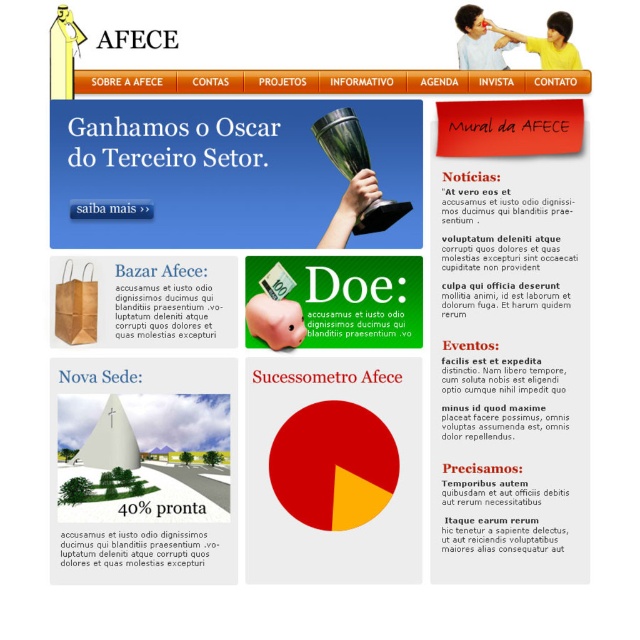
You are designing a webpage layout and need to place two important icons on the page. The first icon is placed at point (490, 442) and the second at point (161, 534). From the perspective of someone viewing the webpage, which icon will appear closer to the viewer?

The icon at point (161, 534) will appear closer to the viewer because point (490, 442) is behind it according to the spatial description.